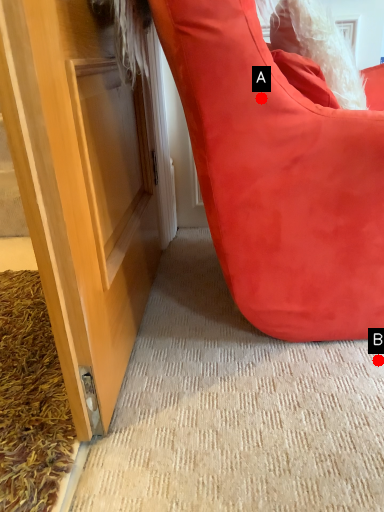
Question: Two points are circled on the image, labeled by A and B beside each circle. Which point is farther to the camera?

Choices:
 (A) A is further
 (B) B is further

Answer: (B)